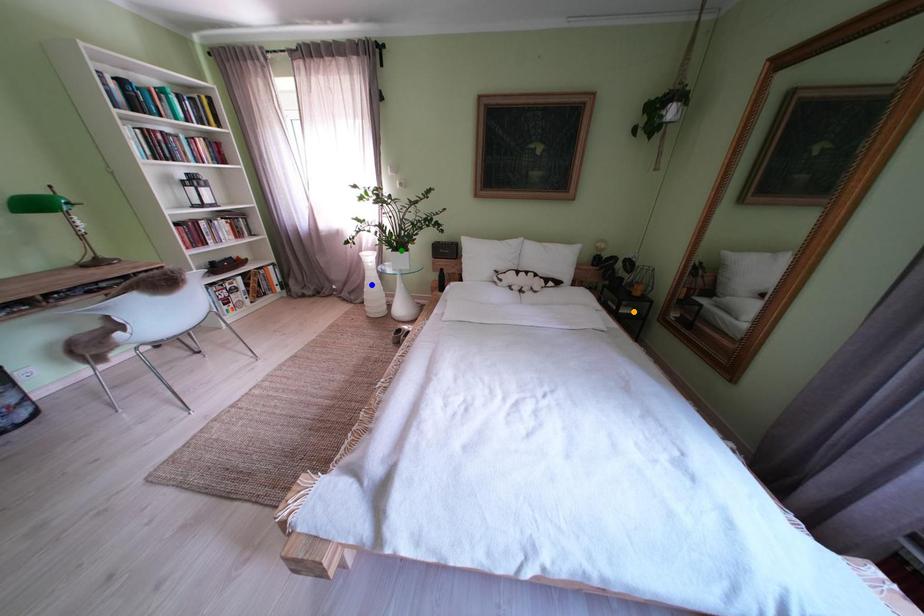
Order these from nearest to farthest:
blue point | green point | orange point

orange point
green point
blue point